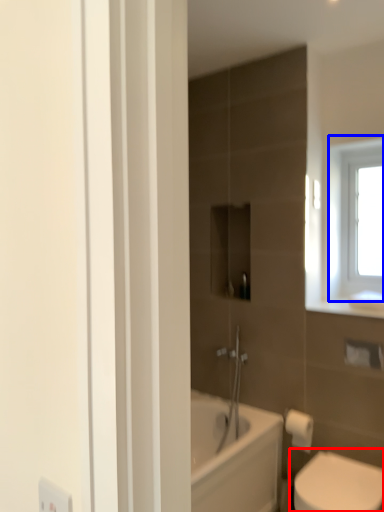
Question: Which object is closer to the camera taking this photo, toilet (highlighted by a red box) or window (highlighted by a blue box)?

Choices:
 (A) toilet
 (B) window

Answer: (A)